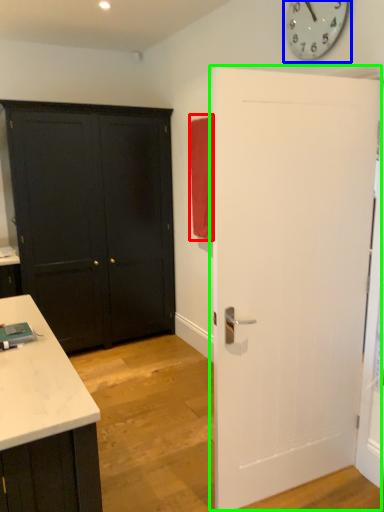
Question: Based on their relative distances, which object is farther from curtain (highlighted by a red box)? Choose from clock (highlighted by a blue box) and door (highlighted by a green box).

Choices:
 (A) clock
 (B) door

Answer: (B)